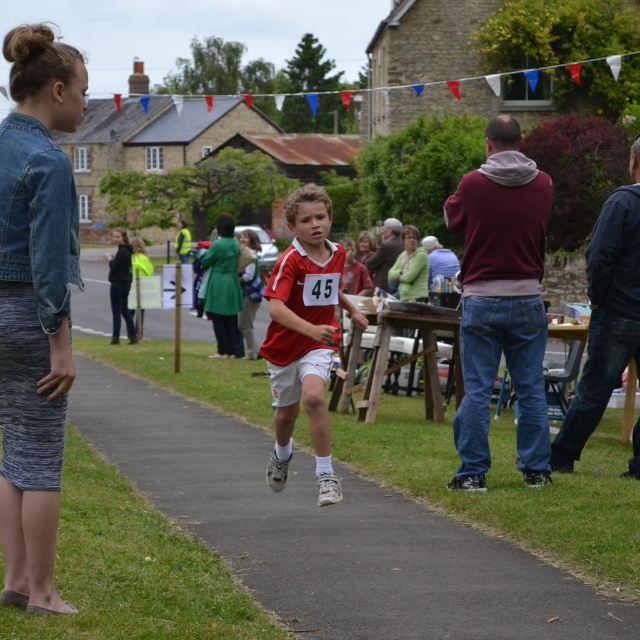
You are a photographer at the event and want to capture both the green textured jacket at center and the green fabric coat at left in a single photo. Which object should you focus on first to ensure both are in frame?

You should focus on the green fabric coat at left first because it is located above the green textured jacket at center, so adjusting the camera angle to include the higher positioned green fabric coat at left will naturally include the lower green textured jacket at center in the frame.

You are a photographer trying to capture both the green textured jacket at center and the green fabric coat at left in a single frame. Since you want to include their full length, which of the two items should you focus on adjusting your camera angle to accommodate?

The green fabric coat at left is taller than the green textured jacket at center, so you should adjust your camera angle to accommodate the taller green fabric coat at left to ensure its full length is captured in the photo.